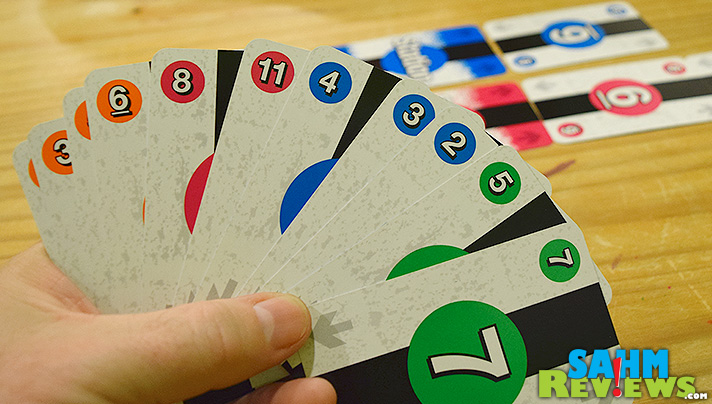
Find the location of a particular element. The image size is (712, 404). wood grain is located at coordinates (644, 201), (614, 171), (678, 274), (466, 330), (468, 258).